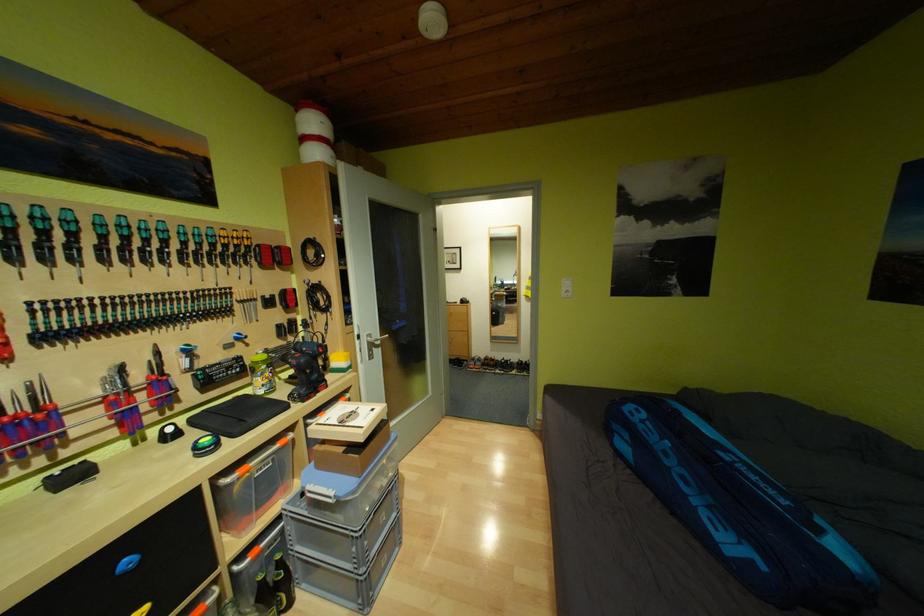
The location [350,453] corresponds to which object?

It corresponds to the cardboard box in the image.